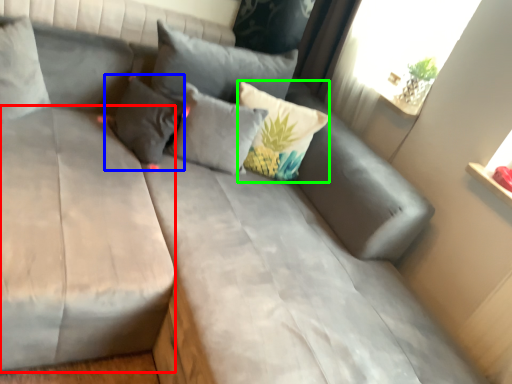
Question: Which object is the farthest from mattress (highlighted by a red box)? Choose among these: pillow (highlighted by a blue box) or pillow (highlighted by a green box).

Choices:
 (A) pillow
 (B) pillow

Answer: (B)